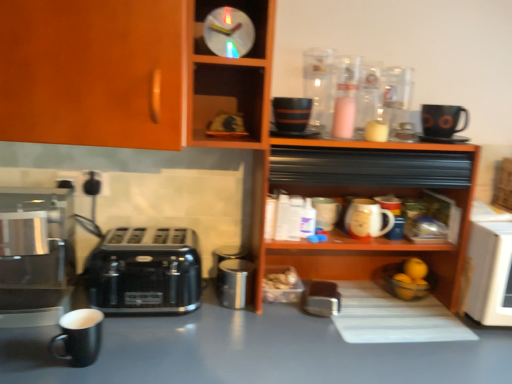
Where is `vacant area that is in front of metallic silver canister at center`? The width and height of the screenshot is (512, 384). vacant area that is in front of metallic silver canister at center is located at coordinates (223, 331).